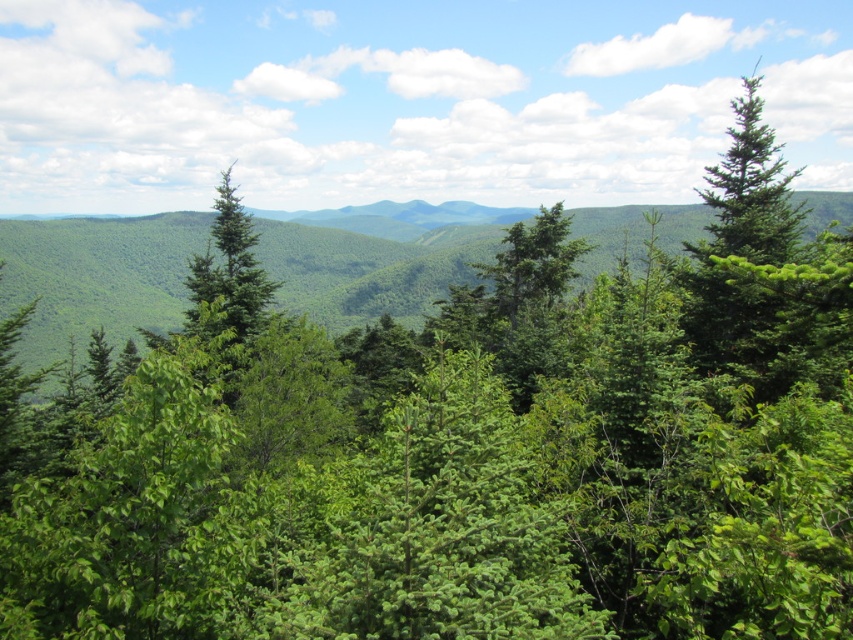
Question: Is green leafy forest at center behind green leafy mountain at center?

Choices:
 (A) yes
 (B) no

Answer: (B)

Question: Does green leafy forest at center appear on the left side of green leafy mountain at center?

Choices:
 (A) no
 (B) yes

Answer: (A)

Question: Which point is closer to the camera taking this photo?

Choices:
 (A) (461, 380)
 (B) (462, 269)

Answer: (A)

Question: Among these points, which one is nearest to the camera?

Choices:
 (A) (639, 412)
 (B) (378, 253)

Answer: (A)

Question: In this image, where is green leafy forest at center located relative to green leafy mountain at center?

Choices:
 (A) left
 (B) right

Answer: (B)